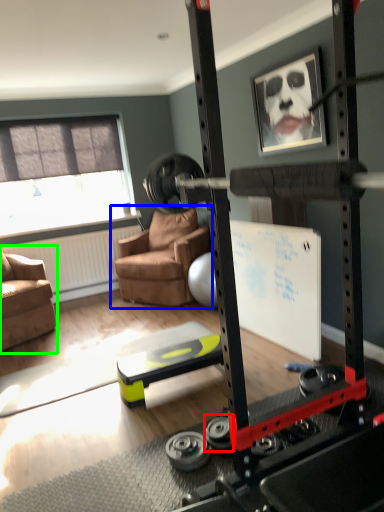
Question: Considering the real-world distances, which object is closest to wheel (highlighted by a red box)? chair (highlighted by a blue box) or chair (highlighted by a green box).

Choices:
 (A) chair
 (B) chair

Answer: (B)